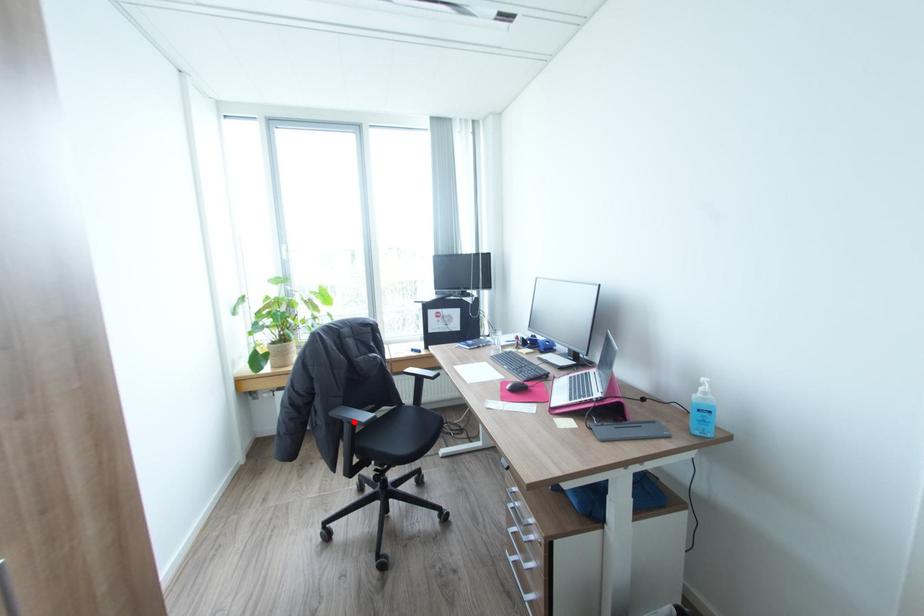
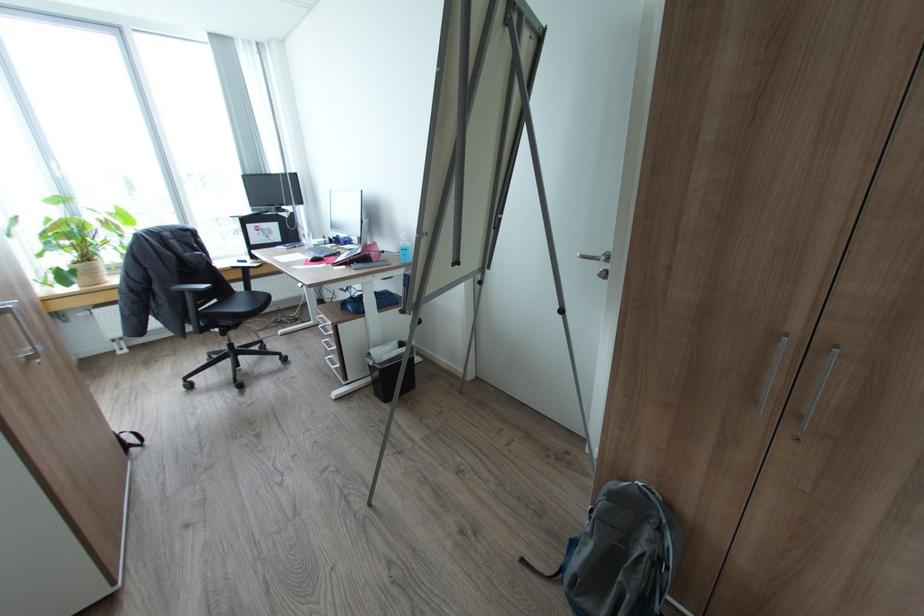
Question: I am providing you with two images of the same scene from different viewpoints. Image1 has a red point marked. In image2, the corresponding 3D location appears at what relative position? Reply with the corresponding letter.

Choices:
 (A) Closer
 (B) Farther

Answer: (B)